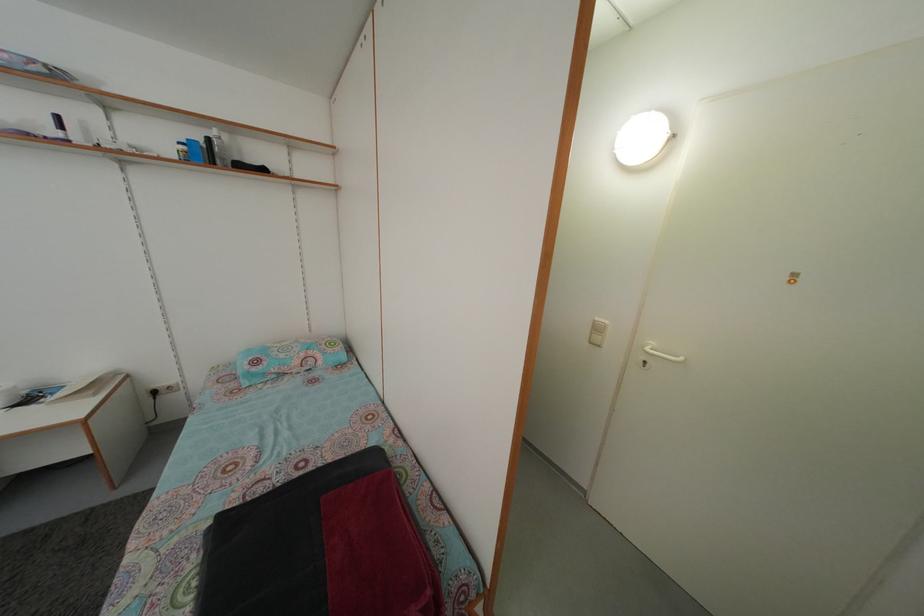
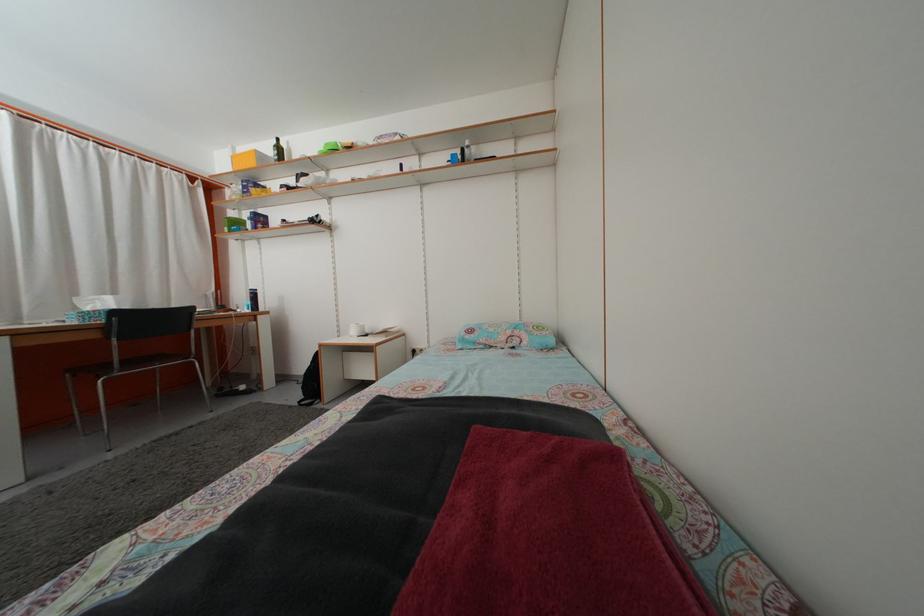
Question: Based on the continuous images, in which direction is the camera rotating? Reply with the corresponding letter.

Choices:
 (A) Left
 (B) Right
 (C) Up
 (D) Down

Answer: (A)